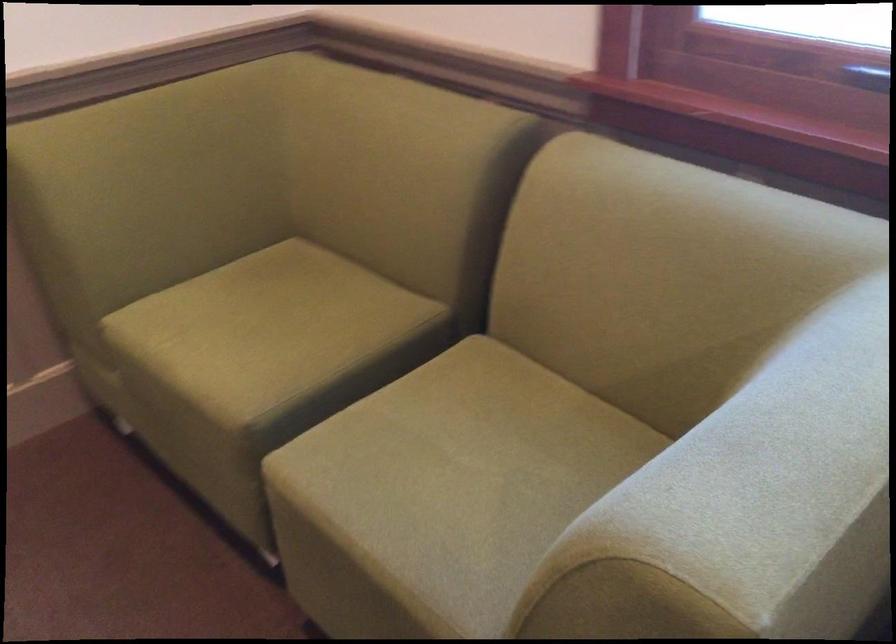
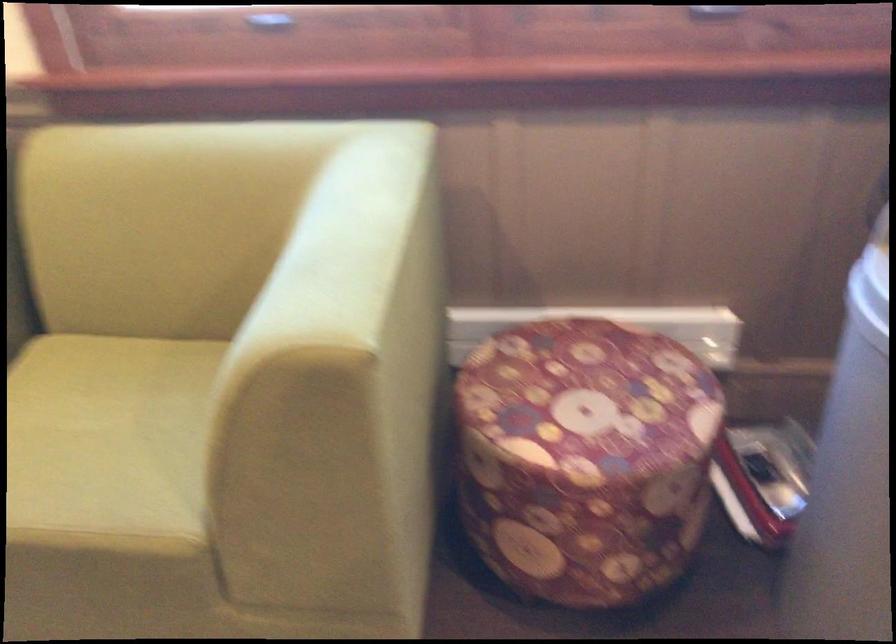
In the second image, find the point that corresponds to point (467, 477) in the first image.

(107, 442)